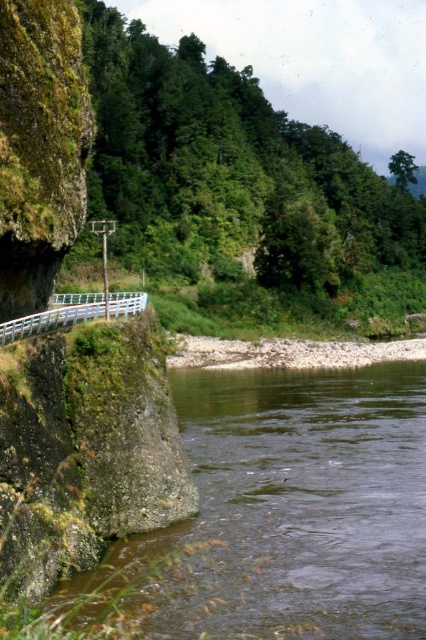
You are standing at the edge of the cliff near the white railing and want to reach the green mossy rock at lower left. Which direction should you move to get closer to it?

The green mossy rock at lower left is located at point [288,509], so you should move towards the lower left direction from your current position near the white railing to reach it.

Based on the photo, you are a hiker standing on the path near the white plastic railing at lower left and the green mossy rock at lower left. You want to take a photo of the river below. Which object should you move closer to for a better view of the river?

The green mossy rock at lower left is not as tall as the white plastic railing at lower left, so moving closer to the green mossy rock at lower left would allow you to see the river better by avoiding obstruction from the taller railing.

You are a hiker standing at the edge of the cliff near the white plastic railing at lower left. You notice a green mossy rock at lower left. Which object is closer to you in size when viewed from your current position?

The white plastic railing at lower left is larger than the green mossy rock at lower left, so the white plastic railing at lower left appears closer in size to you.